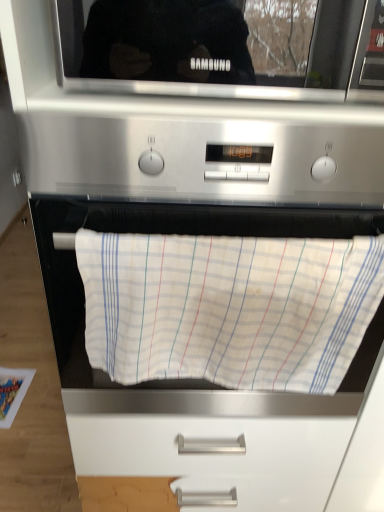
The height and width of the screenshot is (512, 384). Describe the element at coordinates (228, 308) in the screenshot. I see `white cotton towel at center` at that location.

Where is `white cotton towel at center`? This screenshot has width=384, height=512. white cotton towel at center is located at coordinates (228, 308).

From the picture: What is the approximate width of black glossy microwave at upper center?

It is 13.68 inches.

What do you see at coordinates (235, 47) in the screenshot? Image resolution: width=384 pixels, height=512 pixels. I see `black glossy microwave at upper center` at bounding box center [235, 47].

You are a GUI agent. You are given a task and a screenshot of the screen. Output one action in this format:
    pyautogui.click(x=<x>, y=<y>)
    Task: Click on the black glossy microwave at upper center
    This screenshot has width=384, height=512.
    Given the screenshot: What is the action you would take?
    pyautogui.click(x=235, y=47)

Locate an element on the screen. white cotton towel at center is located at coordinates (228, 308).

Considering the relative positions of black glossy microwave at upper center and white cotton towel at center in the image provided, is black glossy microwave at upper center to the left or to the right of white cotton towel at center?

black glossy microwave at upper center is positioned on white cotton towel at center's right side.

Considering the positions of objects black glossy microwave at upper center and white cotton towel at center in the image provided, who is behind, black glossy microwave at upper center or white cotton towel at center?

white cotton towel at center is further away from the camera.

Which is more distant, (x=134, y=38) or (x=216, y=281)?

Positioned behind is point (x=216, y=281).

From the image's perspective, between black glossy microwave at upper center and white cotton towel at center, who is located below?

white cotton towel at center.

From a real-world perspective, is black glossy microwave at upper center located higher than white cotton towel at center?

Correct, in the physical world, black glossy microwave at upper center is higher than white cotton towel at center.

Considering the relative sizes of black glossy microwave at upper center and white cotton towel at center in the image provided, is black glossy microwave at upper center thinner than white cotton towel at center?

In fact, black glossy microwave at upper center might be wider than white cotton towel at center.

From their relative heights in the image, would you say black glossy microwave at upper center is taller or shorter than white cotton towel at center?

Considering their sizes, black glossy microwave at upper center has less height than white cotton towel at center.

Considering the sizes of black glossy microwave at upper center and white cotton towel at center in the image, is black glossy microwave at upper center bigger or smaller than white cotton towel at center?

In the image, black glossy microwave at upper center appears to be larger than white cotton towel at center.

Can we say black glossy microwave at upper center lies outside white cotton towel at center?

Yes, black glossy microwave at upper center is outside of white cotton towel at center.

Is black glossy microwave at upper center not close to white cotton towel at center?

No.

Is black glossy microwave at upper center oriented towards white cotton towel at center?

No, black glossy microwave at upper center is not oriented towards white cotton towel at center.

In order to click on blanket to the left of black glossy microwave at upper center in this screenshot , I will do `click(228, 308)`.

Considering the relative positions of white cotton towel at center and black glossy microwave at upper center in the image provided, is white cotton towel at center to the left of black glossy microwave at upper center from the viewer's perspective?

Indeed, white cotton towel at center is positioned on the left side of black glossy microwave at upper center.

Is white cotton towel at center closer to camera compared to black glossy microwave at upper center?

No, the depth of white cotton towel at center is greater than that of black glossy microwave at upper center.

Does point (354, 352) appear closer or farther from the camera than point (158, 86)?

Point (354, 352) is positioned farther from the camera compared to point (158, 86).

From the image's perspective, between white cotton towel at center and black glossy microwave at upper center, which one is located above?

black glossy microwave at upper center is shown above in the image.

From a real-world perspective, which is physically below, white cotton towel at center or black glossy microwave at upper center?

white cotton towel at center is physically lower.

Can you confirm if white cotton towel at center is thinner than black glossy microwave at upper center?

Yes.

Can you confirm if white cotton towel at center is taller than black glossy microwave at upper center?

Indeed, white cotton towel at center has a greater height compared to black glossy microwave at upper center.

In the scene shown: Considering the relative sizes of white cotton towel at center and black glossy microwave at upper center in the image provided, is white cotton towel at center smaller than black glossy microwave at upper center?

Correct, white cotton towel at center occupies less space than black glossy microwave at upper center.

Is white cotton towel at center spatially inside black glossy microwave at upper center, or outside of it?

white cotton towel at center exists outside the volume of black glossy microwave at upper center.

Is white cotton towel at center far from black glossy microwave at upper center?

No, white cotton towel at center is not far from black glossy microwave at upper center.

Is black glossy microwave at upper center at the back of white cotton towel at center?

No, white cotton towel at center is not facing the opposite direction of black glossy microwave at upper center.

This screenshot has height=512, width=384. Find the location of `microwave oven in front of the white cotton towel at center`. microwave oven in front of the white cotton towel at center is located at coordinates (235, 47).

Where is `blanket that appears below the black glossy microwave at upper center (from a real-world perspective)`? The height and width of the screenshot is (512, 384). blanket that appears below the black glossy microwave at upper center (from a real-world perspective) is located at coordinates (228, 308).

Locate an element on the screen. blanket below the black glossy microwave at upper center (from the image's perspective) is located at coordinates (228, 308).